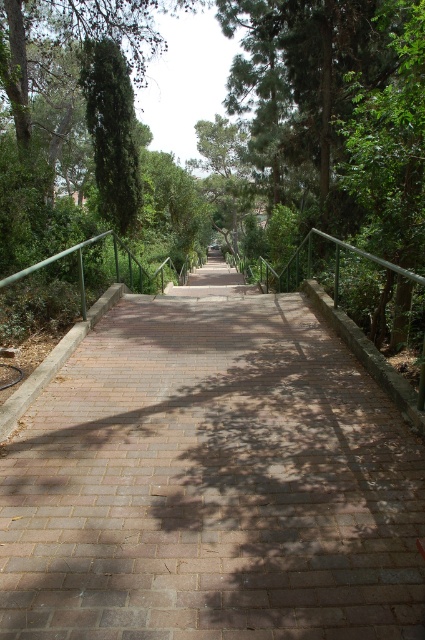
Consider the image. Can you confirm if brick paved path at center is smaller than green leafy tree at upper left?

Incorrect, brick paved path at center is not smaller in size than green leafy tree at upper left.

Does brick paved path at center appear on the right side of green leafy tree at upper left?

Indeed, brick paved path at center is positioned on the right side of green leafy tree at upper left.

Which is in front, point (158, 550) or point (122, 112)?

Point (158, 550)

I want to click on brick paved path at center, so click(212, 481).